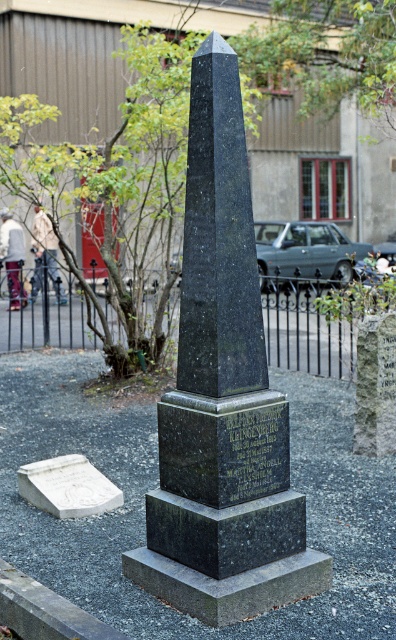
Does black granite obelisk at center appear over white marble gravestone at lower left?

Correct, black granite obelisk at center is located above white marble gravestone at lower left.

Measure the distance between point (x=169, y=476) and camera.

Point (x=169, y=476) is 5.26 meters from camera.

Who is more distant from viewer, (203, 595) or (62, 461)?

Point (62, 461)

The image size is (396, 640). Identify the location of black granite obelisk at center. (222, 397).